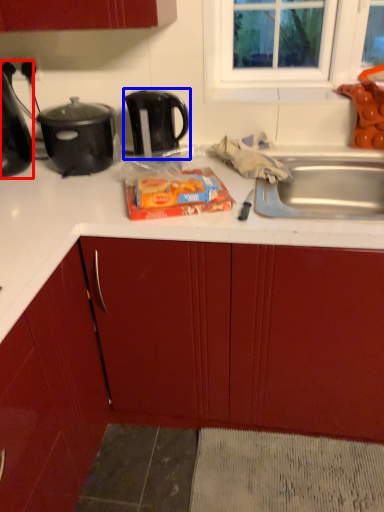
Question: Which point is further to the camera, kitchen appliance (highlighted by a red box) or kettle (highlighted by a blue box)?

Choices:
 (A) kitchen appliance
 (B) kettle

Answer: (B)